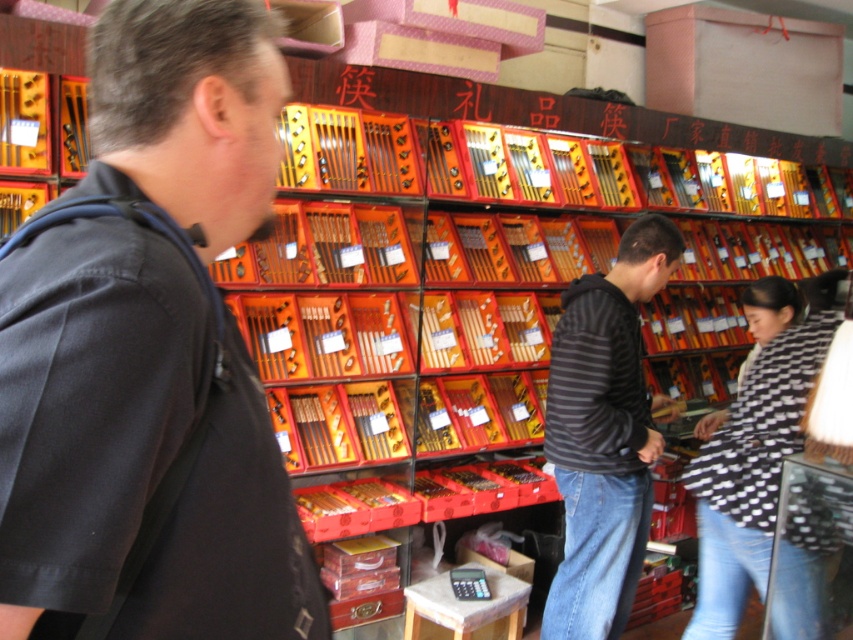
Looking at this image, you are a customer in the chopstick shop and want to place a small decorative item between the black matte shirt at left and the striped hoodie at center. Based on their widths, which side should you place it closer to?

The black matte shirt at left has a lesser width compared to the striped hoodie at center, so you should place the item closer to the black matte shirt at left to ensure it fits between them.

You are a customer in the chopstick shop and want to compare the height of the black matte shirt at left and the black and white checkered shirt at lower right. Which one is taller?

The black and white checkered shirt at lower right is taller than the black matte shirt at left.

You are a customer in the chopstick shop and want to place a decorative vase between the black matte shirt at left and the striped hoodie at center. Which object should the vase be closer to if you want it to be placed at the same height as the taller object?

The striped hoodie at center is taller than the black matte shirt at left. Therefore, the vase should be placed closer to the striped hoodie at center to match its height.